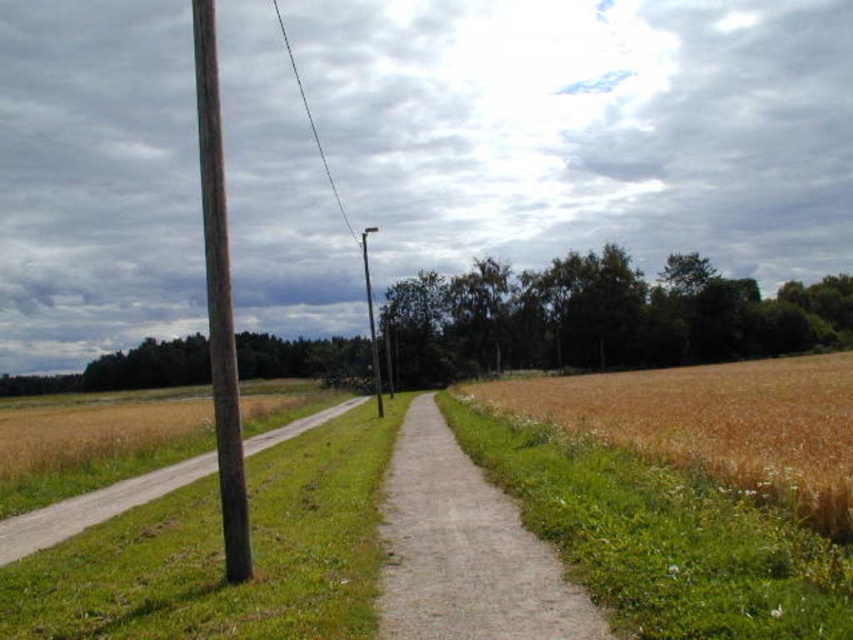
Question: Where is brown grassy wheat field at right located in relation to black wire at upper center in the image?

Choices:
 (A) left
 (B) right

Answer: (B)

Question: Can you confirm if gray gravel path at center is smaller than black wire at upper center?

Choices:
 (A) yes
 (B) no

Answer: (A)

Question: Is gray gravel path at center smaller than brown wooden pole at left?

Choices:
 (A) no
 (B) yes

Answer: (B)

Question: Which object is farther from the camera taking this photo?

Choices:
 (A) metallic gray pole at center
 (B) brown wooden pole at left
 (C) black wire at upper center

Answer: (C)

Question: Which object appears farthest from the camera in this image?

Choices:
 (A) metallic gray pole at center
 (B) brown wooden pole at left
 (C) brown grassy wheat field at right

Answer: (A)

Question: Which point appears farthest from the camera in this image?

Choices:
 (A) (213, 400)
 (B) (309, 419)
 (C) (283, 48)
 (D) (378, 380)

Answer: (C)